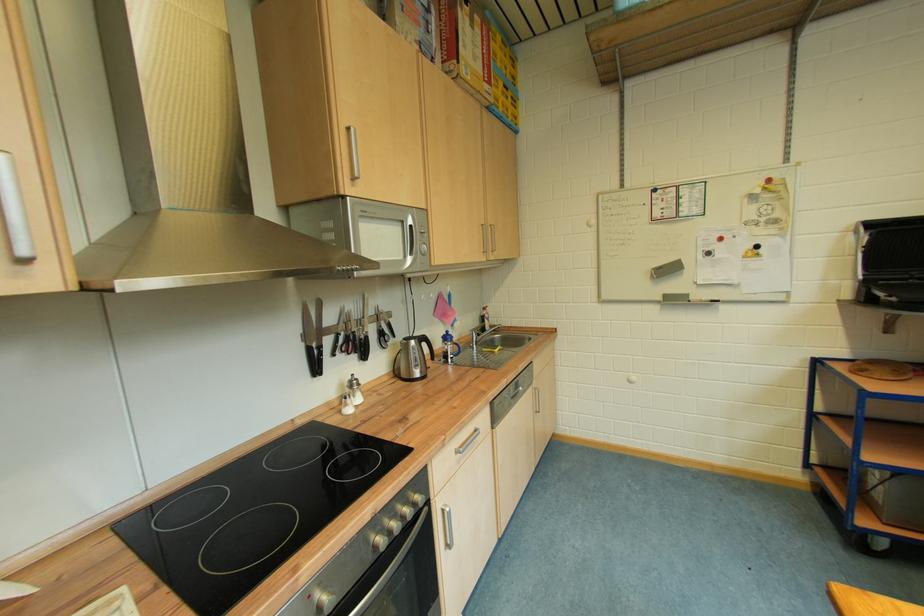
Image resolution: width=924 pixels, height=616 pixels. In order to click on kettle handle in this screenshot , I will do `click(411, 358)`.